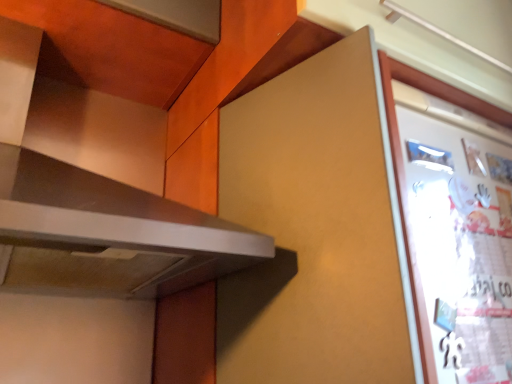
Where is `white glossy bulletin board at right`? white glossy bulletin board at right is located at coordinates (454, 225).

What do you see at coordinates (454, 225) in the screenshot? I see `white glossy bulletin board at right` at bounding box center [454, 225].

The width and height of the screenshot is (512, 384). Find the location of `white glossy bulletin board at right`. white glossy bulletin board at right is located at coordinates (454, 225).